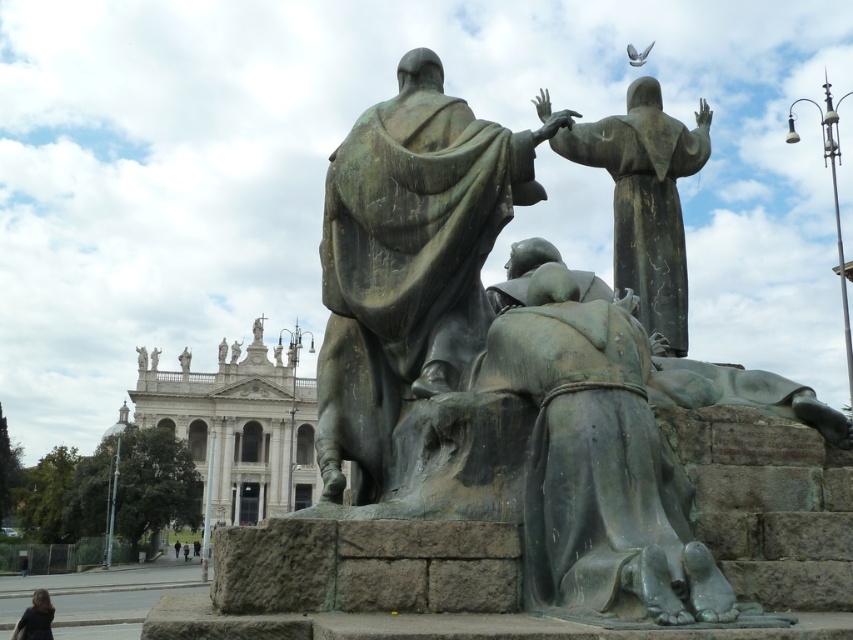
Question: Among these points, which one is nearest to the camera?

Choices:
 (A) (24, 627)
 (B) (357, 364)

Answer: (B)

Question: Observing the image, what is the correct spatial positioning of green patina bronze statue at center in reference to dark brown hair at lower left?

Choices:
 (A) left
 (B) right

Answer: (B)

Question: Is green patina bronze statue at center closer to camera compared to dark brown hair at lower left?

Choices:
 (A) no
 (B) yes

Answer: (B)

Question: Is bronze statue at center below dark brown hair at lower left?

Choices:
 (A) yes
 (B) no

Answer: (B)

Question: Among these objects, which one is nearest to the camera?

Choices:
 (A) dark brown hair at lower left
 (B) bronze statue at center

Answer: (B)

Question: Which point is closer to the camera?

Choices:
 (A) (685, 580)
 (B) (18, 628)

Answer: (A)